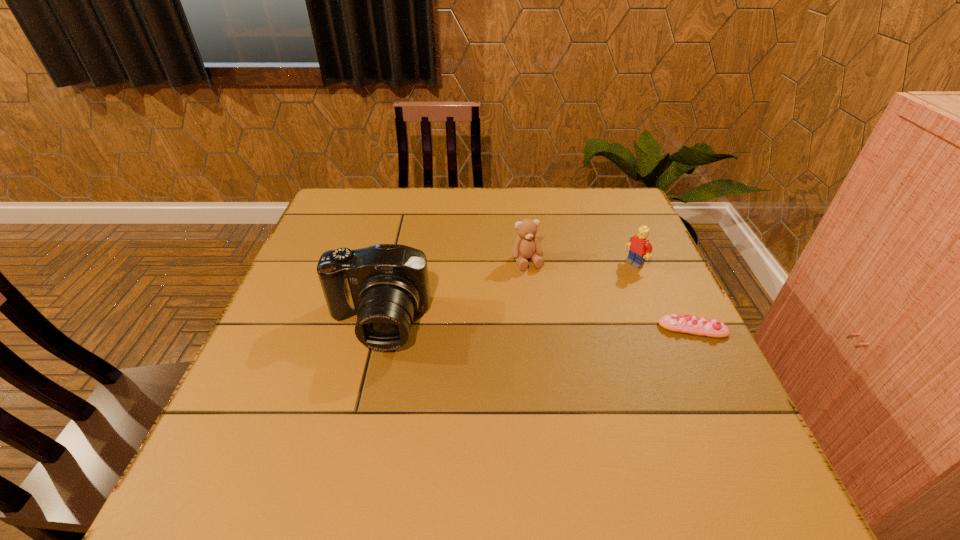
Find the location of `unoccupied area between the third object from right to left and the Lego`. unoccupied area between the third object from right to left and the Lego is located at coordinates (581, 262).

The width and height of the screenshot is (960, 540). What are the coordinates of `empty space that is in between the camera and the Lego` in the screenshot? It's located at (506, 293).

The height and width of the screenshot is (540, 960). I want to click on free space between the Lego and the leftmost object, so click(x=506, y=293).

Find the location of `vacant area that lies between the teddy bear and the leftmost object`. vacant area that lies between the teddy bear and the leftmost object is located at coordinates (452, 292).

Select which object is the closest to the teddy bear. Please provide its 2D coordinates. Your answer should be formatted as a tuple, i.e. [(x, y)], where the tuple contains the x and y coordinates of a point satisfying the conditions above.

[(640, 248)]

You are a GUI agent. You are given a task and a screenshot of the screen. Output one action in this format:
    pyautogui.click(x=<x>, y=<y>)
    Task: Click on the object that is the closest to the Lego
    Image resolution: width=960 pixels, height=540 pixels.
    Given the screenshot: What is the action you would take?
    pyautogui.click(x=691, y=325)

You are a GUI agent. You are given a task and a screenshot of the screen. Output one action in this format:
    pyautogui.click(x=<x>, y=<y>)
    Task: Click on the vacant area that satisfies the following two spatial constraints: 1. on the front side of the Lego; 2. on the right side of the second object from left to right
    
    Given the screenshot: What is the action you would take?
    pyautogui.click(x=527, y=264)

This screenshot has width=960, height=540. What are the coordinates of `free region that satisfies the following two spatial constraints: 1. on the lens of the shortest object; 2. on the left side of the leftmost object` in the screenshot? It's located at (375, 329).

In order to click on vacant position in the image that satisfies the following two spatial constraints: 1. on the front side of the second object from left to right; 2. on the right side of the shortest object in this screenshot , I will do `click(536, 329)`.

Identify the location of free spot that satisfies the following two spatial constraints: 1. on the lens of the eclair; 2. on the left side of the camera. This screenshot has height=540, width=960. (375, 329).